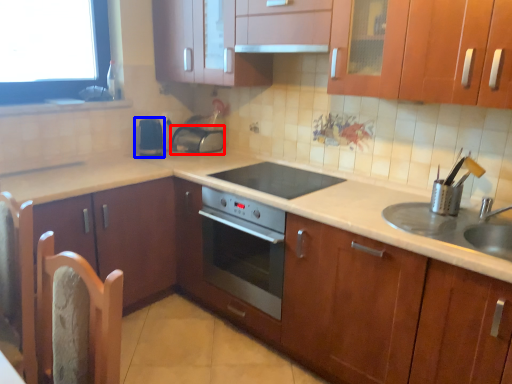
Question: Which of the following is the closest to the observer, appliance (highlighted by a red box) or appliance (highlighted by a blue box)?

Choices:
 (A) appliance
 (B) appliance

Answer: (B)